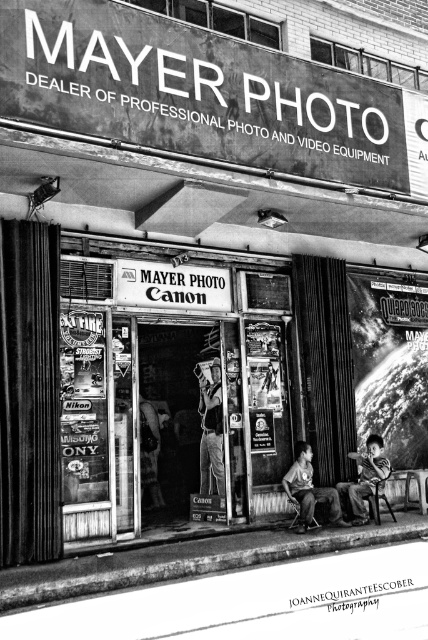
You are a customer entering Mayer Photo to buy a helmet that fits over a shirt. You see the metallic silver helmet at center and the matte gray shirt at center. Based on their sizes, will the helmet fit over the shirt?

The metallic silver helmet at center has a lesser width compared to the matte gray shirt at center, so the helmet may not fit properly over the shirt since it is narrower.

You are a photographer standing in front of Mayer Photo. You see two points on the store window at coordinates point (219, 465) and point (330, 499). Which point is closer to you?

Point (330, 499) is closer to you because it is less further to the camera than point (219, 465).